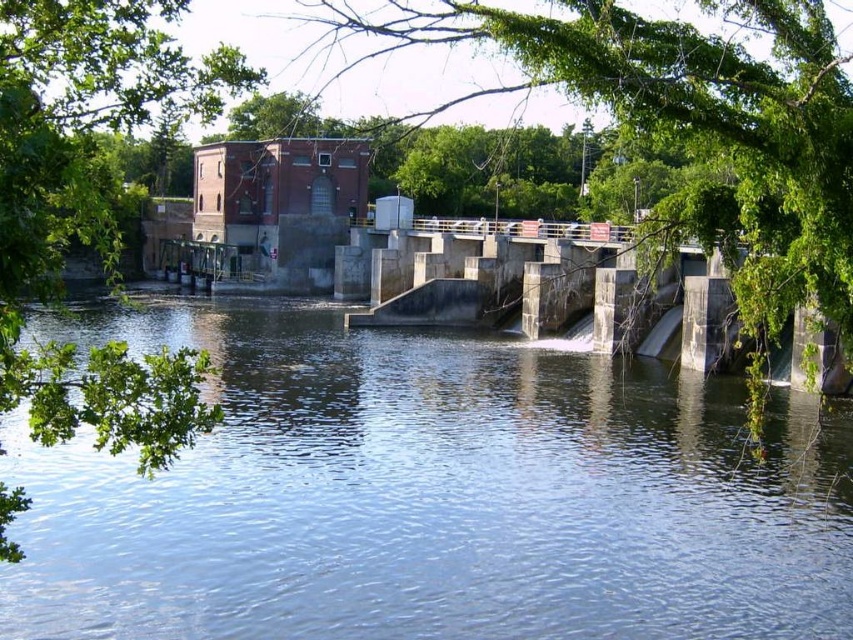
Question: Which of these objects is positioned farthest from the green leafy tree at left?

Choices:
 (A) green leafy tree at upper center
 (B) clear water at center

Answer: (A)

Question: Estimate the real-world distances between objects in this image. Which object is farther from the clear water at center?

Choices:
 (A) green leafy tree at left
 (B) green leafy tree at upper center

Answer: (B)

Question: Does green leafy tree at upper center have a greater width compared to green leafy tree at left?

Choices:
 (A) no
 (B) yes

Answer: (B)

Question: Which of the following is the farthest from the observer?

Choices:
 (A) (575, 77)
 (B) (814, 412)
 (C) (148, 410)

Answer: (B)

Question: Where is green leafy tree at upper center located in relation to green leafy tree at left in the image?

Choices:
 (A) left
 (B) right

Answer: (B)

Question: Does clear water at center have a lesser width compared to green leafy tree at left?

Choices:
 (A) no
 (B) yes

Answer: (A)